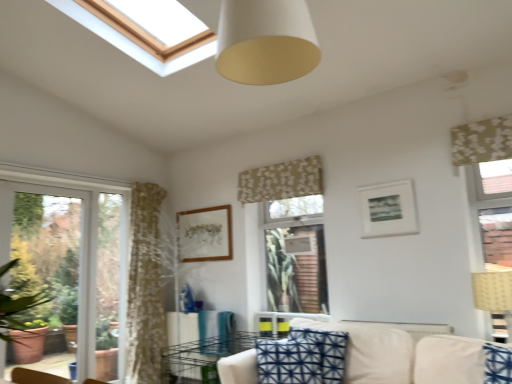
Question: From their relative heights in the image, would you say beige woven lampshade at right is taller or shorter than floral fabric curtain at center, which is the first curtain from left to right?

Choices:
 (A) short
 (B) tall

Answer: (B)

Question: Does point (497, 297) appear closer or farther from the camera than point (240, 195)?

Choices:
 (A) farther
 (B) closer

Answer: (B)

Question: Which of these objects is positioned closest to the blue printed cushion at center?

Choices:
 (A) white matte cone at upper center
 (B) white matte picture frame at upper right, which is the 1th picture frame in front-to-back order
 (C) beige woven lampshade at right
 (D) beige fabric couch at lower center
 (E) green floral fabric curtain at upper right, which is the 2th curtain from back to front

Answer: (D)

Question: Based on their relative distances, which object is farther from the green floral fabric curtain at upper right, which is the 2th curtain from back to front?

Choices:
 (A) beige woven lampshade at right
 (B) white glass window at left
 (C) white matte cone at upper center
 (D) beige fabric couch at lower center
 (E) white matte picture frame at upper right, acting as the first picture frame starting from the right

Answer: (B)